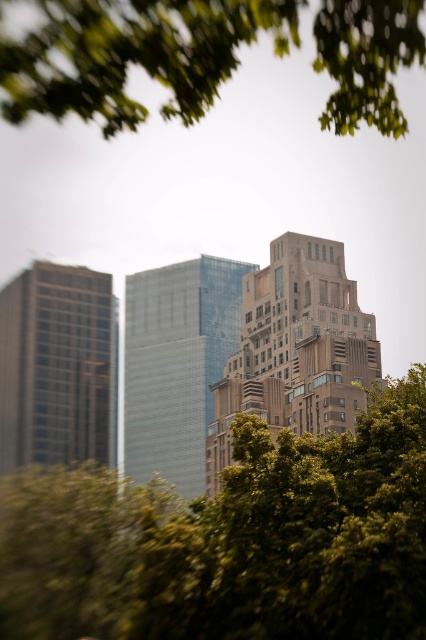
Between green leafy tree at center and brown stone building at center, which one appears on the right side from the viewer's perspective?

brown stone building at center is more to the right.

Who is positioned more to the left, green leafy tree at center or brown stone building at center?

From the viewer's perspective, green leafy tree at center appears more on the left side.

This screenshot has width=426, height=640. I want to click on green leafy tree at center, so click(232, 540).

Is green leafy tree at upper center thinner than brown stone building at center?

Yes.

Measure the distance between point (x=62, y=19) and camera.

Point (x=62, y=19) is 23.30 meters from camera.

Is point (386, 19) closer to camera compared to point (293, 305)?

Yes, it is.

Where is `green leafy tree at upper center`? green leafy tree at upper center is located at coordinates (132, 54).

Can you confirm if green leafy tree at upper center is thinner than glassy reflective skyscraper at left?

Correct, green leafy tree at upper center's width is less than glassy reflective skyscraper at left's.

Between green leafy tree at upper center and glassy reflective skyscraper at left, which one has more height?

With more height is glassy reflective skyscraper at left.

Between point (267, 28) and point (97, 416), which one is positioned behind?

The point (97, 416) is behind.

This screenshot has height=640, width=426. In order to click on green leafy tree at upper center in this screenshot , I will do `click(132, 54)`.